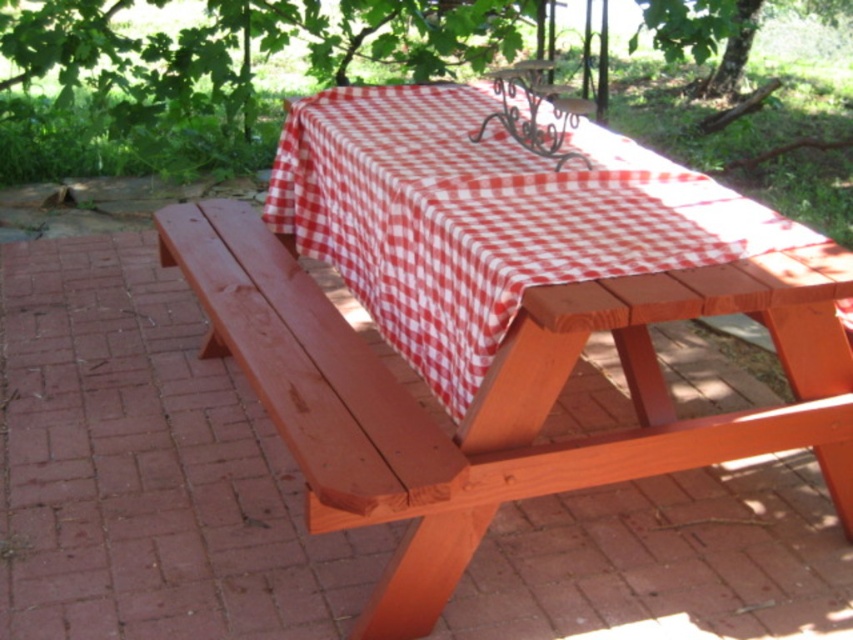
You are planning to set up a small garden party and need to place a 10 feet long banner between the smooth wood bench at left and the green leafy tree at upper center. Can the banner fit between them without overlapping either object?

The smooth wood bench at left and green leafy tree at upper center are 10.54 feet apart from each other. Since the banner is 10 feet long, it can fit between them without overlapping either object as the distance is slightly longer than the banner.

You are planning to have a picnic under the green leafy tree at upper center. Can you confirm if the red checkered tablecloth at center is placed directly under the tree?

The red checkered tablecloth at center is below green leafy tree at upper center, so yes, the tablecloth is placed directly under the tree.

You are sitting at the picnic table and want to place a plate on the red checkered tablecloth at center and a book on the smooth wood bench at left. Which object will you reach first?

The red checkered tablecloth at center is closer to you than the smooth wood bench at left, so you will reach the red checkered tablecloth at center first.